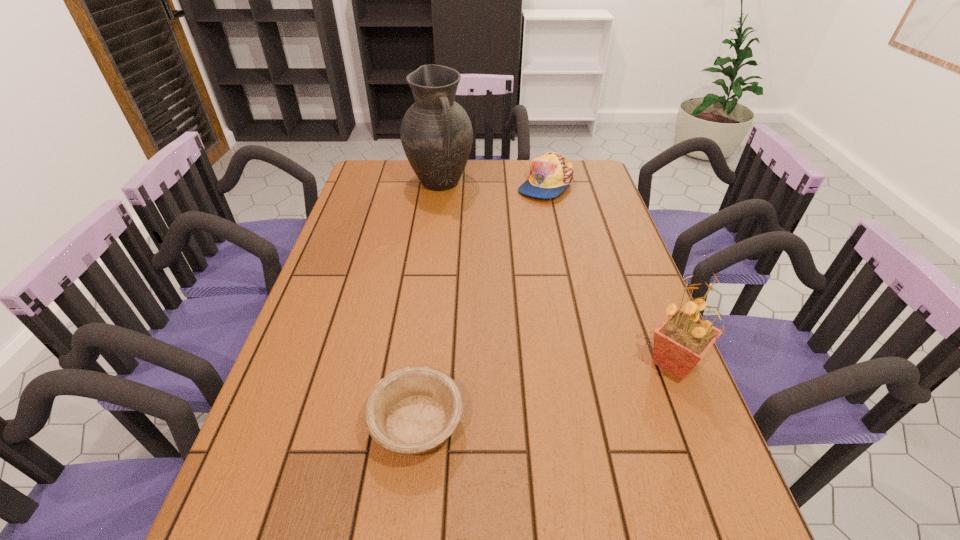
Identify the location of free space located 0.210m on the side of the pitcher with the handle. (471, 234).

Where is `vacant point located on the side of the pitcher with the handle`? vacant point located on the side of the pitcher with the handle is located at coordinates (481, 250).

At what (x,y) coordinates should I click in order to perform the action: click on vacant space located on the side of the pitcher with the handle. Please return your answer as a coordinate pair (x, y). Looking at the image, I should click on (482, 252).

The image size is (960, 540). Find the location of `vacant area situated on the bill of the second object from right to left`. vacant area situated on the bill of the second object from right to left is located at coordinates (553, 244).

You are a GUI agent. You are given a task and a screenshot of the screen. Output one action in this format:
    pyautogui.click(x=<x>, y=<y>)
    Task: Click on the vacant space located on the bill of the second object from right to left
    
    Given the screenshot: What is the action you would take?
    pyautogui.click(x=550, y=224)

In order to click on vacant area situated 0.070m on the bill of the second object from right to left in this screenshot , I will do `click(549, 215)`.

Where is `pitcher located in the far edge section of the desktop`? The image size is (960, 540). pitcher located in the far edge section of the desktop is located at coordinates (436, 134).

Locate an element on the screen. The image size is (960, 540). cap present at the far edge is located at coordinates (551, 173).

Where is `object located at the near edge`? object located at the near edge is located at coordinates (413, 410).

This screenshot has width=960, height=540. In order to click on sunflower at the right edge in this screenshot , I will do `click(680, 342)`.